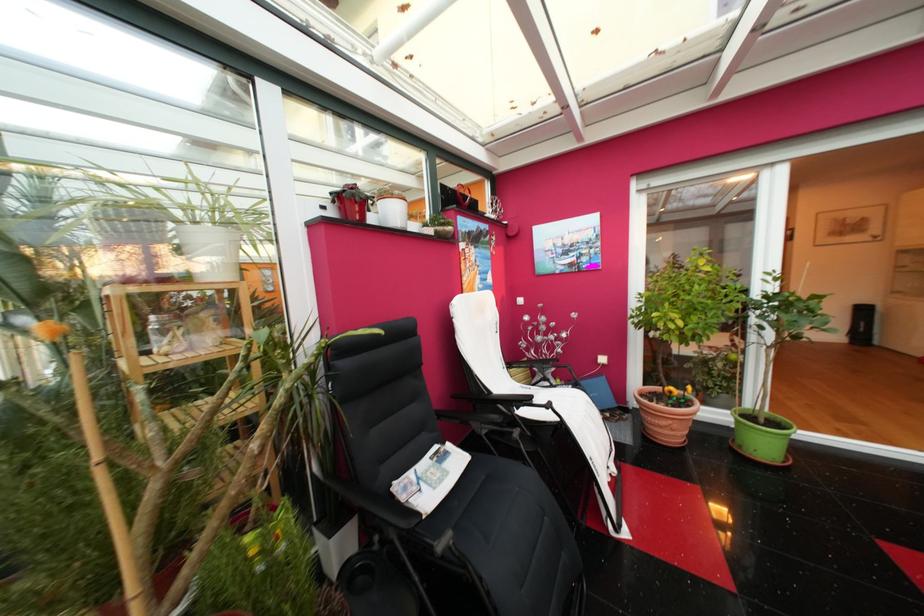
The image size is (924, 616). What are the coordinates of `white plant pot` in the screenshot? It's located at pyautogui.click(x=210, y=252).